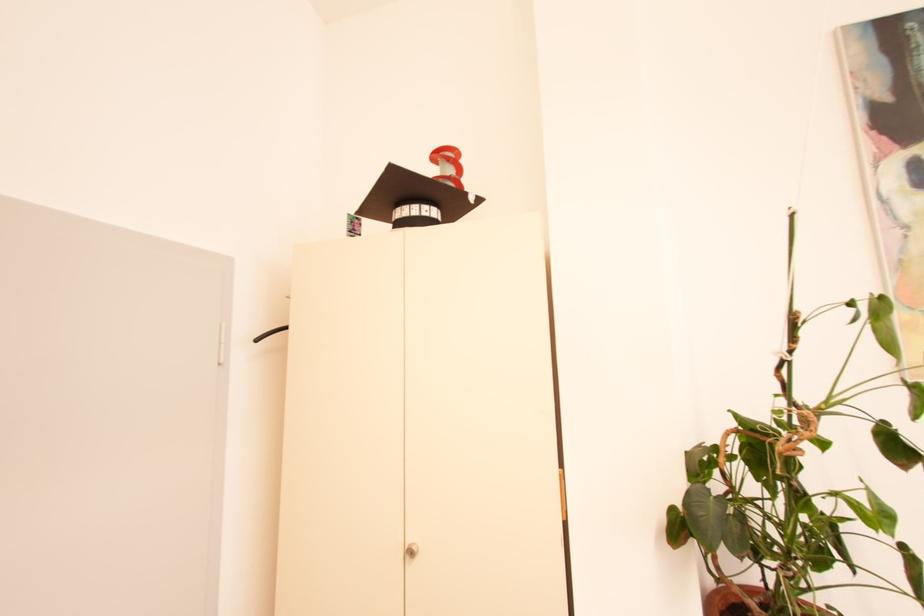
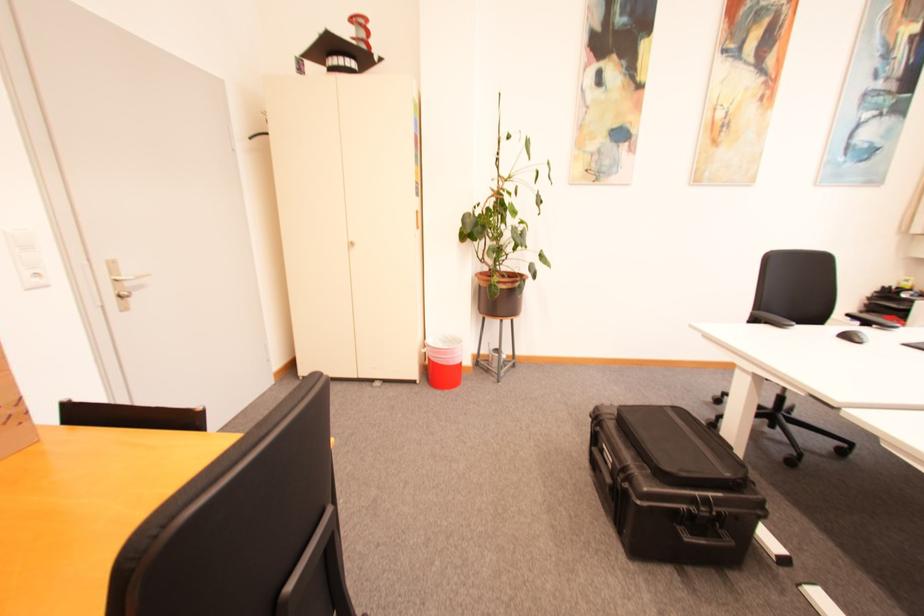
Locate, in the second image, the point that corresponds to point 419,553 in the first image.

(359, 245)